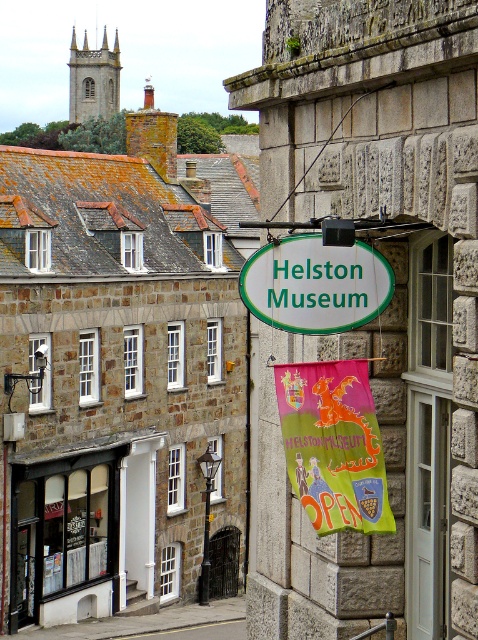
Question: Which of the following is the closest to the observer?

Choices:
 (A) (325, 253)
 (B) (68, 493)

Answer: (A)

Question: Which object appears farthest from the camera in this image?

Choices:
 (A) white glass storefront at lower left
 (B) white oval sign at center

Answer: (A)

Question: Is white glass storefront at lower left to the right of white oval sign at center from the viewer's perspective?

Choices:
 (A) yes
 (B) no

Answer: (B)

Question: Is white glass storefront at lower left above white oval sign at center?

Choices:
 (A) yes
 (B) no

Answer: (B)

Question: Is white glass storefront at lower left positioned before white oval sign at center?

Choices:
 (A) yes
 (B) no

Answer: (B)